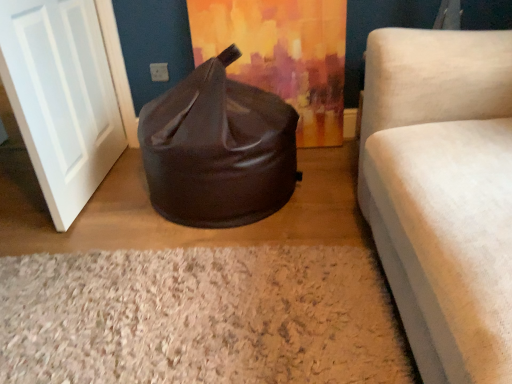
Question: From a real-world perspective, is brown leather bean bag at center physically located above or below white matte door at left?

Choices:
 (A) below
 (B) above

Answer: (A)

Question: Choose the correct answer: Is brown leather bean bag at center inside white matte door at left or outside it?

Choices:
 (A) outside
 (B) inside

Answer: (A)

Question: Based on their relative distances, which object is nearer to the white matte door at left?

Choices:
 (A) brown leather bean bag at center
 (B) white shaggy rug at lower center
 (C) brown leather bean bag at center

Answer: (A)

Question: Which is farther from the white shaggy rug at lower center?

Choices:
 (A) brown leather bean bag at center
 (B) brown leather bean bag at center
 (C) white matte door at left

Answer: (A)